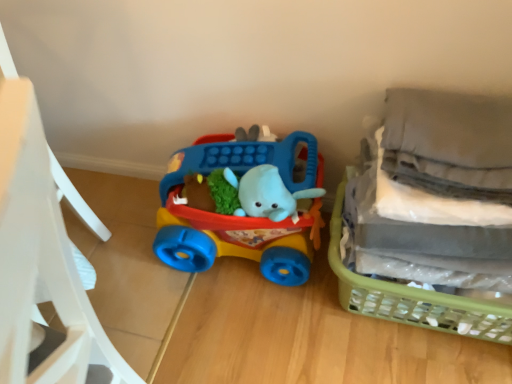
Question: Can you confirm if matte plastic toy car at center is wider than matte plastic chair at left?

Choices:
 (A) no
 (B) yes

Answer: (A)

Question: Does matte plastic toy car at center contain matte plastic chair at left?

Choices:
 (A) yes
 (B) no

Answer: (B)

Question: From a real-world perspective, is matte plastic toy car at center physically above matte plastic chair at left?

Choices:
 (A) no
 (B) yes

Answer: (A)

Question: Does matte plastic toy car at center appear on the right side of matte plastic chair at left?

Choices:
 (A) no
 (B) yes

Answer: (B)

Question: Is matte plastic toy car at center further to camera compared to matte plastic chair at left?

Choices:
 (A) yes
 (B) no

Answer: (A)

Question: Is matte plastic toy car at center positioned beyond the bounds of matte plastic chair at left?

Choices:
 (A) yes
 (B) no

Answer: (A)

Question: Is matte plastic chair at left smaller than green plastic basket at right?

Choices:
 (A) no
 (B) yes

Answer: (A)

Question: Is matte plastic chair at left located outside green plastic basket at right?

Choices:
 (A) yes
 (B) no

Answer: (A)

Question: From a real-world perspective, is matte plastic chair at left positioned over green plastic basket at right based on gravity?

Choices:
 (A) no
 (B) yes

Answer: (B)

Question: Is matte plastic chair at left taller than green plastic basket at right?

Choices:
 (A) no
 (B) yes

Answer: (B)

Question: Is matte plastic chair at left facing towards green plastic basket at right?

Choices:
 (A) yes
 (B) no

Answer: (B)

Question: Does matte plastic chair at left touch green plastic basket at right?

Choices:
 (A) no
 (B) yes

Answer: (A)

Question: Is matte plastic toy car at center shorter than green plastic basket at right?

Choices:
 (A) yes
 (B) no

Answer: (B)